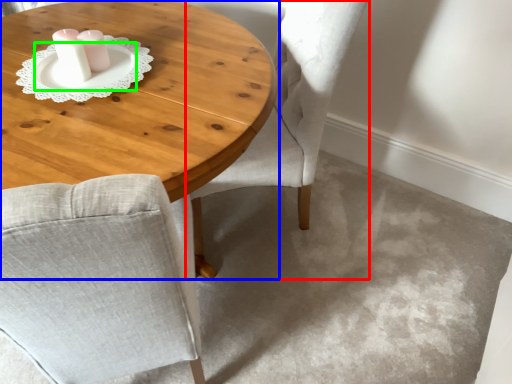
Question: Which is nearer to the chair (highlighted by a red box)? coffee table (highlighted by a blue box) or saucer (highlighted by a green box).

Choices:
 (A) coffee table
 (B) saucer

Answer: (A)